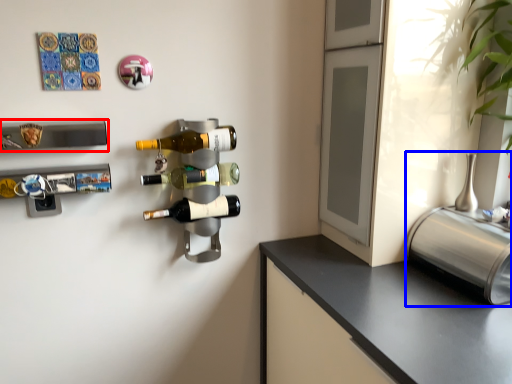
Question: Which of the following is the farthest to the observer, wine rack (highlighted by a red box) or appliance (highlighted by a blue box)?

Choices:
 (A) wine rack
 (B) appliance

Answer: (A)